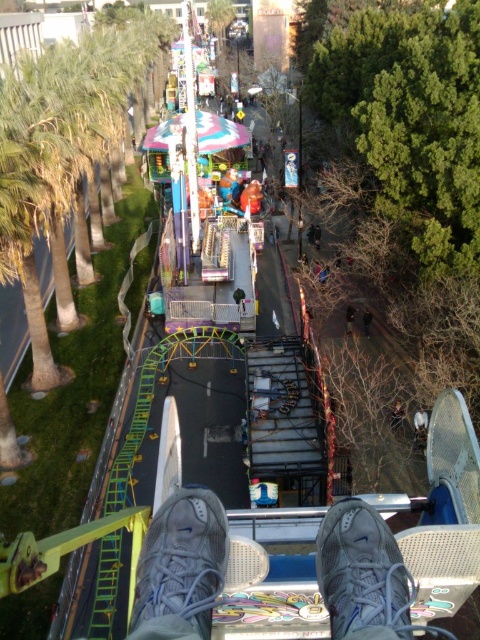
You are sitting on a Ferris wheel and looking down at the amusement park. You notice your two shoes, the gray fabric shoe at lower center and the white mesh shoe at lower center. Which shoe is positioned to the left side of the other?

The gray fabric shoe at lower center is positioned to the left of the white mesh shoe at lower center.